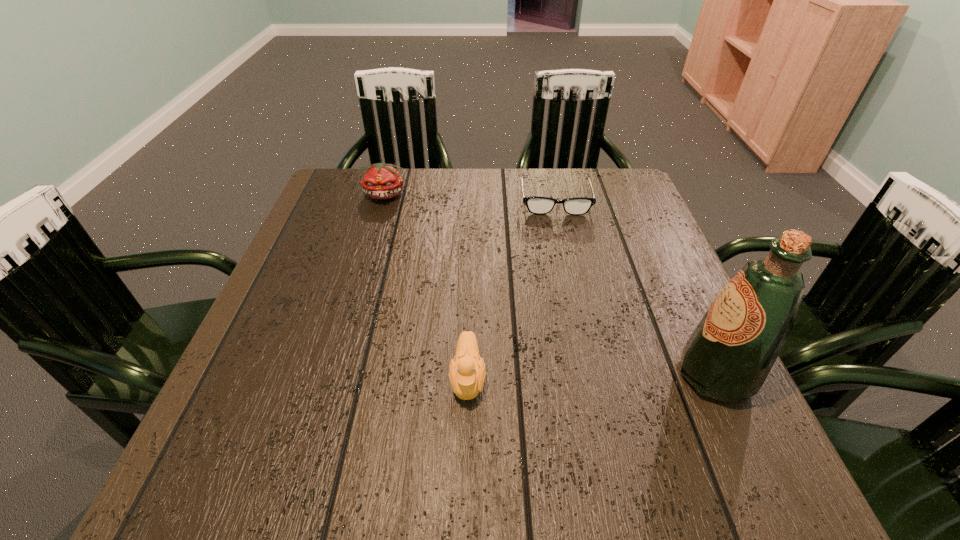
Where is `free space located 0.180m on the front-facing side of the spectacles`? The width and height of the screenshot is (960, 540). free space located 0.180m on the front-facing side of the spectacles is located at coordinates (564, 260).

Locate an element on the screen. The image size is (960, 540). vacant space situated 0.330m on the front-facing side of the spectacles is located at coordinates (572, 307).

Where is `vacant space situated on the front-facing side of the tomato`? vacant space situated on the front-facing side of the tomato is located at coordinates (464, 278).

The width and height of the screenshot is (960, 540). In order to click on free spot located on the front-facing side of the tomato in this screenshot , I will do `click(443, 256)`.

You are a GUI agent. You are given a task and a screenshot of the screen. Output one action in this format:
    pyautogui.click(x=<x>, y=<y>)
    Task: Click on the free space located 0.290m on the front-facing side of the tomato
    The height and width of the screenshot is (540, 960).
    Given the screenshot: What is the action you would take?
    449,263

Where is `spectacles that is at the far edge`? The image size is (960, 540). spectacles that is at the far edge is located at coordinates (538, 205).

Where is `tomato at the far edge`? The height and width of the screenshot is (540, 960). tomato at the far edge is located at coordinates (381, 181).

The height and width of the screenshot is (540, 960). I want to click on duckling positioned at the near edge, so click(x=467, y=374).

Locate an element on the screen. olive oil that is at the near edge is located at coordinates (728, 357).

Find the location of a particular element. object at the left edge is located at coordinates (381, 181).